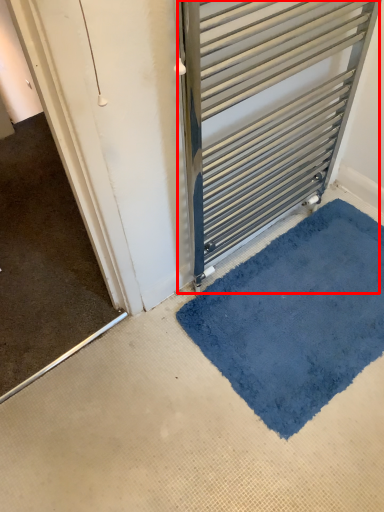
Question: Considering the relative positions of door (annotated by the red box) and bath mat in the image provided, where is door (annotated by the red box) located with respect to the staircase?

Choices:
 (A) right
 (B) left

Answer: (B)